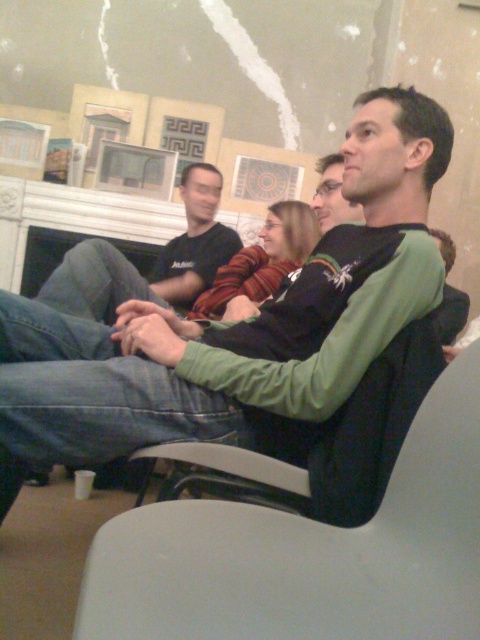
Is white plastic swivel chair at lower center shorter than black cotton shirt at upper center?

Yes.

Does white plastic swivel chair at lower center have a greater height compared to black cotton shirt at upper center?

Incorrect, white plastic swivel chair at lower center's height is not larger of black cotton shirt at upper center's.

Who is more forward, (398, 458) or (222, 224)?

Point (398, 458) is in front.

At what (x,y) coordinates should I click in order to perform the action: click on white plastic swivel chair at lower center. Please return your answer as a coordinate pair (x, y). Looking at the image, I should click on (308, 552).

Between green fleece sweater at center and black cotton shirt at upper center, which one has more height?

green fleece sweater at center

Does green fleece sweater at center have a smaller size compared to black cotton shirt at upper center?

No, green fleece sweater at center is not smaller than black cotton shirt at upper center.

Between point (236, 412) and point (187, 208), which one is positioned behind?

The point (187, 208) is more distant.

This screenshot has width=480, height=640. I want to click on green fleece sweater at center, so click(228, 324).

Between point (297, 364) and point (231, 468), which one is positioned behind?

Point (297, 364)

Where is `green fleece sweater at center`? The height and width of the screenshot is (640, 480). green fleece sweater at center is located at coordinates (228, 324).